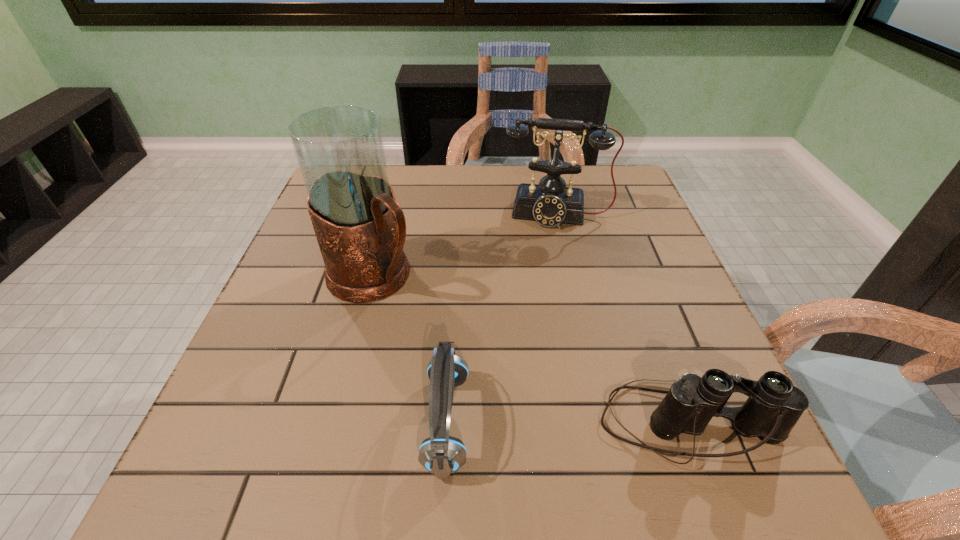
I want to click on free space that satisfies the following two spatial constraints: 1. on the back side of the third shortest object; 2. on the left side of the pitcher, so click(x=390, y=214).

The height and width of the screenshot is (540, 960). I want to click on vacant space that satisfies the following two spatial constraints: 1. on the front side of the headset; 2. on the ear cups of the leftmost object, so click(x=336, y=422).

I want to click on free space that satisfies the following two spatial constraints: 1. on the front side of the third nearest object; 2. on the ear cups of the headset, so click(x=336, y=422).